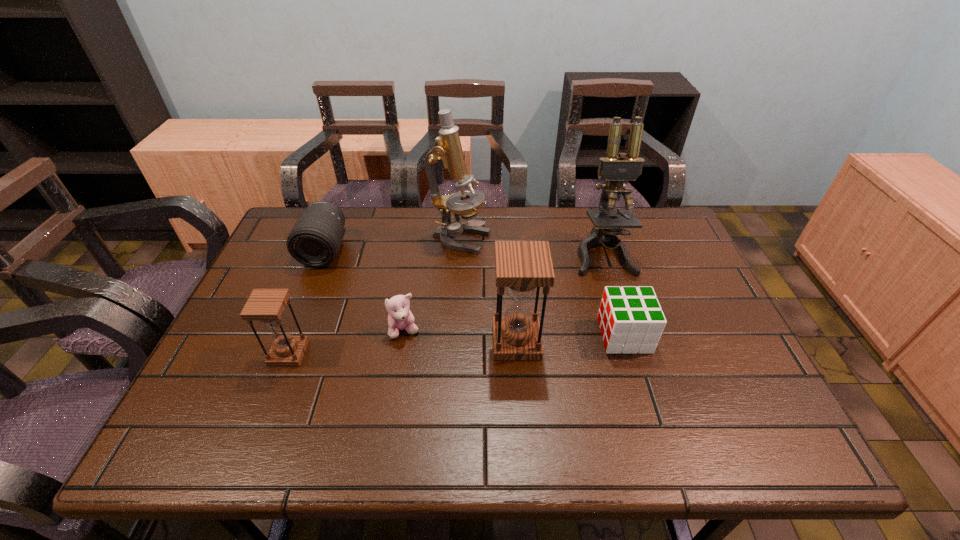
At what (x,y) coordinates should I click in order to perform the action: click on telephoto lens at the left edge. Please return your answer as a coordinate pair (x, y). The width and height of the screenshot is (960, 540). Looking at the image, I should click on (314, 241).

Where is `object positioned at the far left corner`? object positioned at the far left corner is located at coordinates (314, 241).

You are a GUI agent. You are given a task and a screenshot of the screen. Output one action in this format:
    pyautogui.click(x=<x>, y=<y>)
    Task: Click on the vacant space at the far edge of the desktop
    Image resolution: width=960 pixels, height=540 pixels.
    Given the screenshot: What is the action you would take?
    pyautogui.click(x=501, y=220)

Locate an element on the screen. The width and height of the screenshot is (960, 540). vacant space at the near edge of the desktop is located at coordinates (549, 399).

The image size is (960, 540). In the image, there is a desktop. In order to click on vacant space at the left edge in this screenshot , I will do `click(293, 328)`.

The width and height of the screenshot is (960, 540). I want to click on vacant region at the right edge of the desktop, so click(x=704, y=374).

This screenshot has height=540, width=960. What are the coordinates of `free location at the far right corner of the desktop` in the screenshot? It's located at (647, 214).

This screenshot has width=960, height=540. I want to click on vacant space at the near right corner of the desktop, so click(x=746, y=387).

Identify the location of vacant area that lies between the teddy bear and the third shortest object. (365, 291).

Identify the location of free spot between the fifth tallest object and the right microscope. (464, 252).